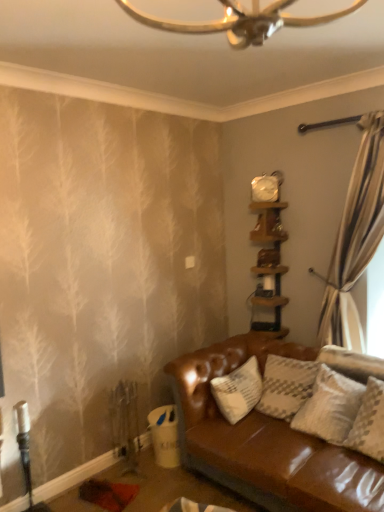
Question: Can you confirm if wooden shelf at upper right, placed as the 2th shelf when sorted from top to bottom, is shorter than wooden shelf at upper right, the 1th shelf from the top?

Choices:
 (A) no
 (B) yes

Answer: (A)

Question: From the image's perspective, does wooden shelf at upper right, which is the first shelf from bottom to top, appear lower than wooden shelf at upper right, the second shelf positioned from the bottom?

Choices:
 (A) no
 (B) yes

Answer: (B)

Question: Considering the relative sizes of wooden shelf at upper right, which is the first shelf from bottom to top, and wooden shelf at upper right, the 1th shelf from the top, in the image provided, is wooden shelf at upper right, which is the first shelf from bottom to top, thinner than wooden shelf at upper right, the 1th shelf from the top,?

Choices:
 (A) no
 (B) yes

Answer: (A)

Question: From a real-world perspective, is wooden shelf at upper right, placed as the 2th shelf when sorted from top to bottom, physically above wooden shelf at upper right, the second shelf positioned from the bottom?

Choices:
 (A) no
 (B) yes

Answer: (A)

Question: Can you confirm if wooden shelf at upper right, which is the first shelf from bottom to top, is smaller than wooden shelf at upper right, the 1th shelf from the top?

Choices:
 (A) yes
 (B) no

Answer: (B)

Question: Is wooden shelf at upper right, which is the first shelf from bottom to top, to the left of wooden shelf at upper right, the 1th shelf from the top, from the viewer's perspective?

Choices:
 (A) yes
 (B) no

Answer: (B)

Question: Can you confirm if white glossy clock at upper center is shorter than wooden shelf at upper right, the second shelf positioned from the bottom?

Choices:
 (A) no
 (B) yes

Answer: (A)

Question: Can you confirm if white glossy clock at upper center is bigger than wooden shelf at upper right, the 1th shelf from the top?

Choices:
 (A) no
 (B) yes

Answer: (A)

Question: From the image's perspective, would you say white glossy clock at upper center is positioned over wooden shelf at upper right, the 1th shelf from the top?

Choices:
 (A) no
 (B) yes

Answer: (B)

Question: From a real-world perspective, is white glossy clock at upper center physically above wooden shelf at upper right, the 1th shelf from the top?

Choices:
 (A) yes
 (B) no

Answer: (A)

Question: Is white glossy clock at upper center oriented away from wooden shelf at upper right, the 1th shelf from the top?

Choices:
 (A) no
 (B) yes

Answer: (A)

Question: Could you tell me if white glossy clock at upper center is turned towards wooden shelf at upper right, the 1th shelf from the top?

Choices:
 (A) no
 (B) yes

Answer: (A)

Question: Could you tell me if wooden shelf at upper right, which is the first shelf from bottom to top, is facing white glossy clock at upper center?

Choices:
 (A) no
 (B) yes

Answer: (A)